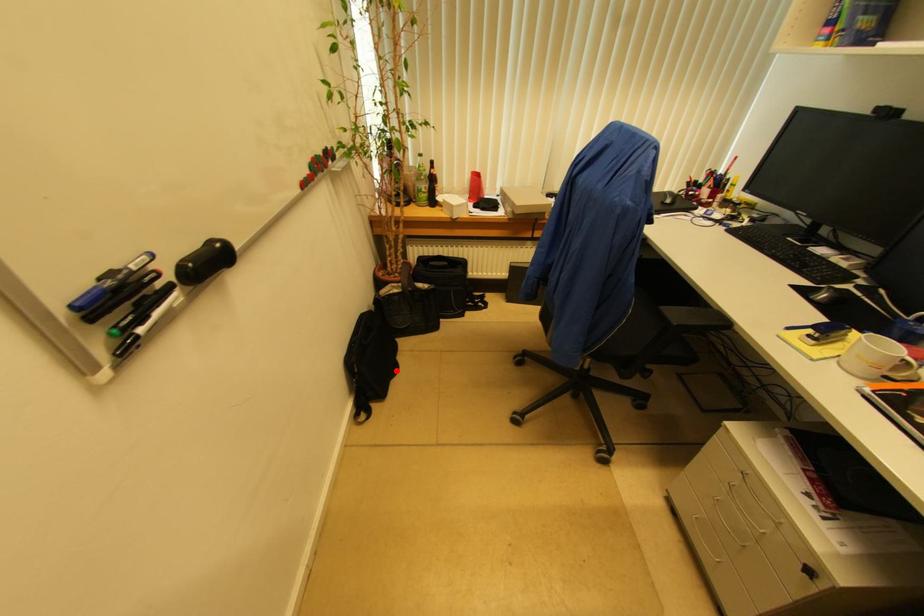
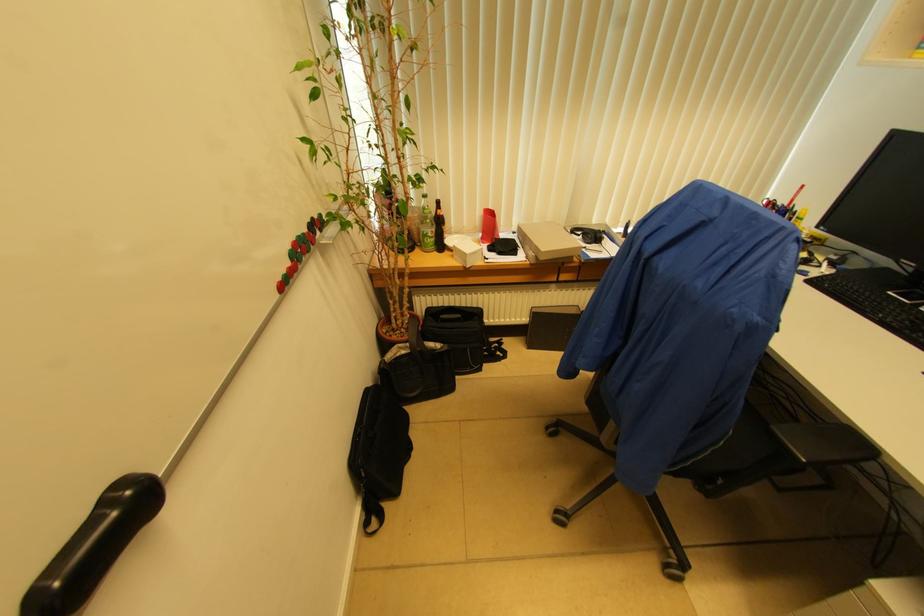
In the second image, find the point that corresponds to the highlighted location in the first image.

(409, 451)